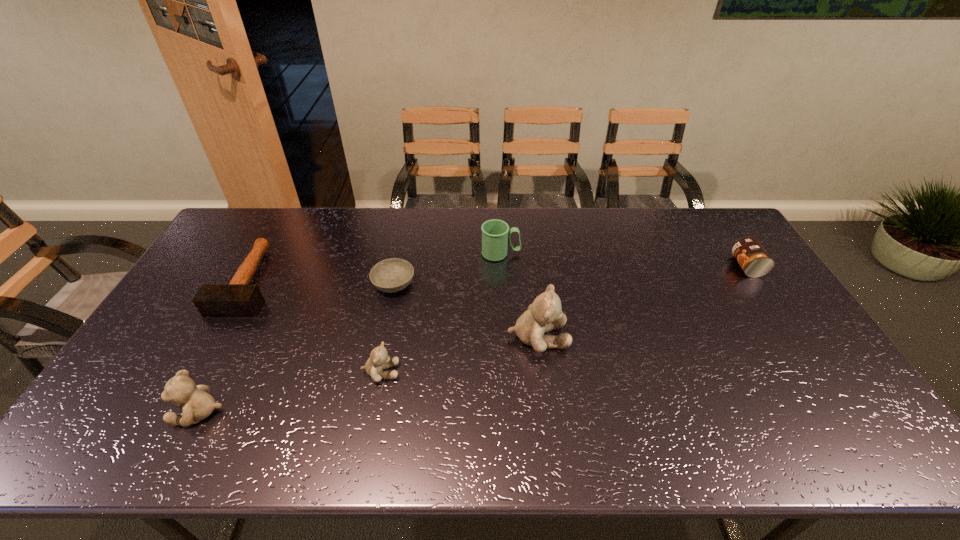
What are the coordinates of `vacant space located 0.280m on the front label of the rightmost object` in the screenshot? It's located at (650, 266).

Where is `object located in the far edge section of the desktop`? This screenshot has width=960, height=540. object located in the far edge section of the desktop is located at coordinates (495, 233).

The height and width of the screenshot is (540, 960). What are the coordinates of `object at the left edge` in the screenshot? It's located at [238, 298].

Locate an element on the screen. This screenshot has width=960, height=540. object at the right edge is located at coordinates (753, 259).

The height and width of the screenshot is (540, 960). What are the coordinates of `vacant space at the far edge` in the screenshot? It's located at (306, 207).

Locate an element on the screen. vacant space at the near edge of the desktop is located at coordinates (477, 404).

Where is `free spot at the left edge of the desktop`? This screenshot has height=540, width=960. free spot at the left edge of the desktop is located at coordinates (170, 380).

Where is `free spot at the right edge of the desktop`? The height and width of the screenshot is (540, 960). free spot at the right edge of the desktop is located at coordinates (753, 294).

Image resolution: width=960 pixels, height=540 pixels. Identify the location of free space at the near left corner of the desktop. (156, 394).

Where is `vacant space at the far right corner of the desktop`? Image resolution: width=960 pixels, height=540 pixels. vacant space at the far right corner of the desktop is located at coordinates (712, 215).